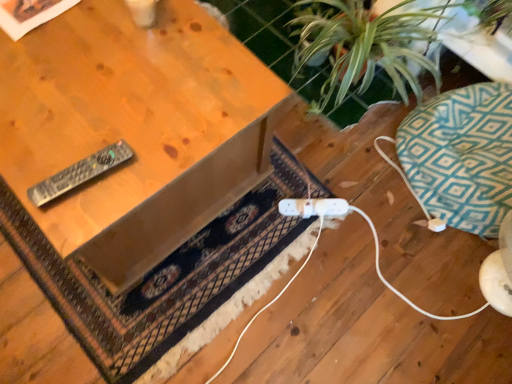
You are a GUI agent. You are given a task and a screenshot of the screen. Output one action in this format:
    pyautogui.click(x=<x>, y=<y>)
    Task: Click on the vacant space behind black plastic remote at left
    Image resolution: width=512 pixels, height=384 pixels.
    Given the screenshot: What is the action you would take?
    pyautogui.click(x=100, y=110)